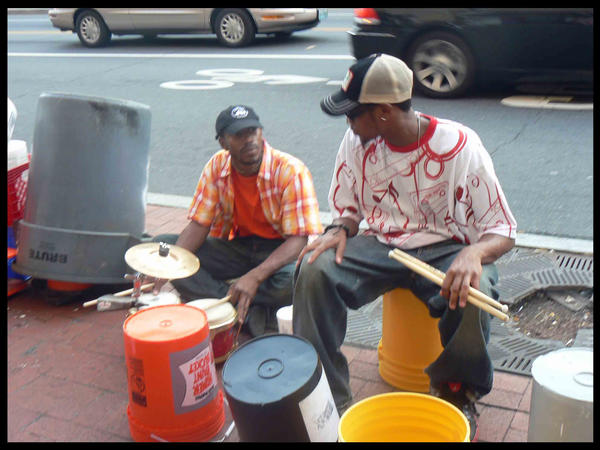
Image resolution: width=600 pixels, height=450 pixels. I want to click on trashcan, so click(108, 172).